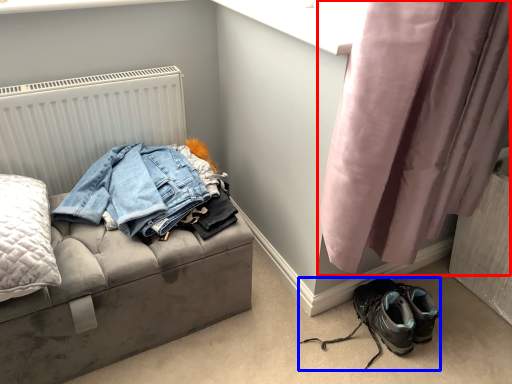
Question: Among these objects, which one is nearest to the camera, curtain (highlighted by a red box) or footwear (highlighted by a blue box)?

Choices:
 (A) curtain
 (B) footwear

Answer: (A)